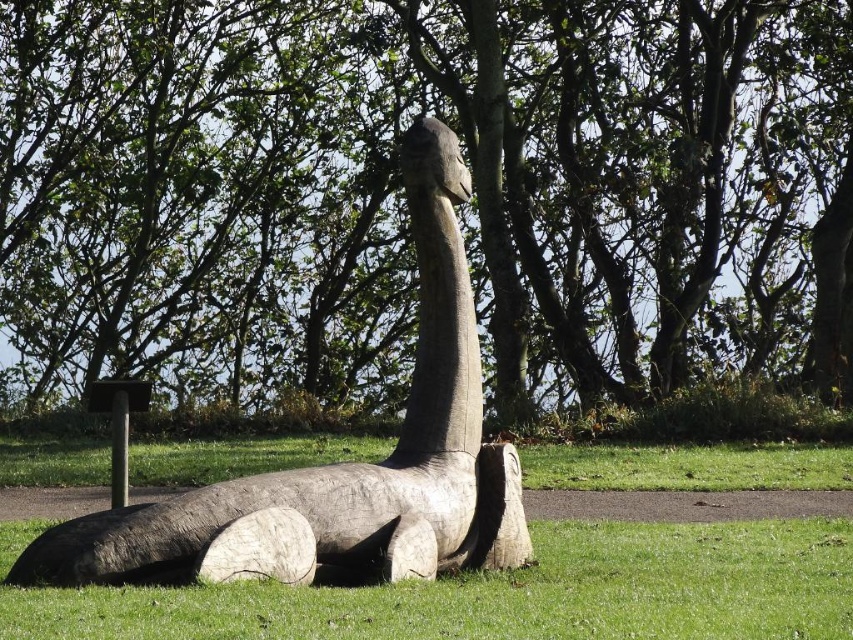
Question: Is green wood tree at center behind green matte wood at center?

Choices:
 (A) no
 (B) yes

Answer: (B)

Question: Based on their relative distances, which object is farther from the wooden statue at center?

Choices:
 (A) green wood tree at center
 (B) green matte wood at center

Answer: (A)

Question: Among these objects, which one is nearest to the camera?

Choices:
 (A) green matte wood at center
 (B) wooden statue at center

Answer: (A)

Question: Can you confirm if green matte wood at center is positioned to the left of wooden statue at center?

Choices:
 (A) no
 (B) yes

Answer: (A)

Question: Which object appears farthest from the camera in this image?

Choices:
 (A) wooden statue at center
 (B) green matte wood at center

Answer: (A)

Question: Is green wood tree at center to the right of wooden statue at center from the viewer's perspective?

Choices:
 (A) no
 (B) yes

Answer: (A)